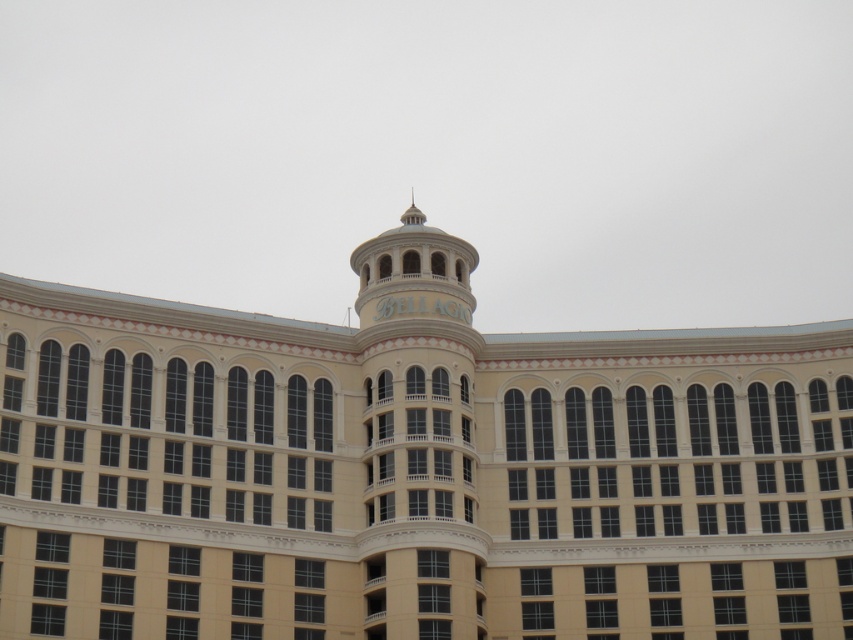
You are standing in front of the Bellagio Hotel and want to take a photo of the beige stone building at center and the white marble bell tower at center. Which one will appear larger in your photo?

The beige stone building at center will appear larger in the photo because it is closer to the viewer than the white marble bell tower at center.

You are standing in front of the Bellagio Hotel and notice two structures. One is the beige stone building at center and the other is the white marble bell tower at center. Which structure is positioned lower in the image?

The beige stone building at center is located below the white marble bell tower at center, so it is positioned lower in the image.

Looking at this image, you are an architect designing a new sculpture that needs to be placed exactly halfway between the beige stone building at center and the white marble bell tower at center. What is the minimum distance the sculpture should be from each structure to ensure it is centered?

The beige stone building at center and white marble bell tower at center are 10.32 meters apart. To place the sculpture exactly halfway, it should be 5.16 meters away from each structure.